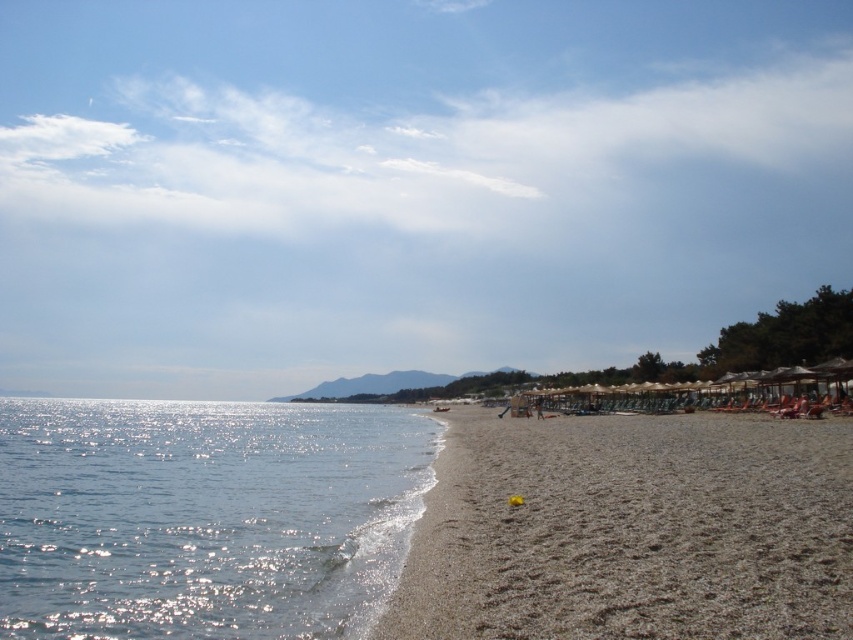
You are standing on the beach and see the shiny blue water at lower left. If you walk straight towards the water, will you reach it before the shoreline?

Yes, because the shiny blue water at lower left is located at point (202,516), which is closer to your current position than the shoreline.

You are standing at the shoreline on the beach and see two points marked in the image. Which point is closer to you, point (225,605) or point (479,596)?

Point (225,605) is closer to you because it is further to the viewer than point (479,596).

You are standing on the beach and looking at the image. There is a point marked at coordinates (405,186). What color is the area at this point?

The point at coordinates (405,186) marks the blue sky at upper center.